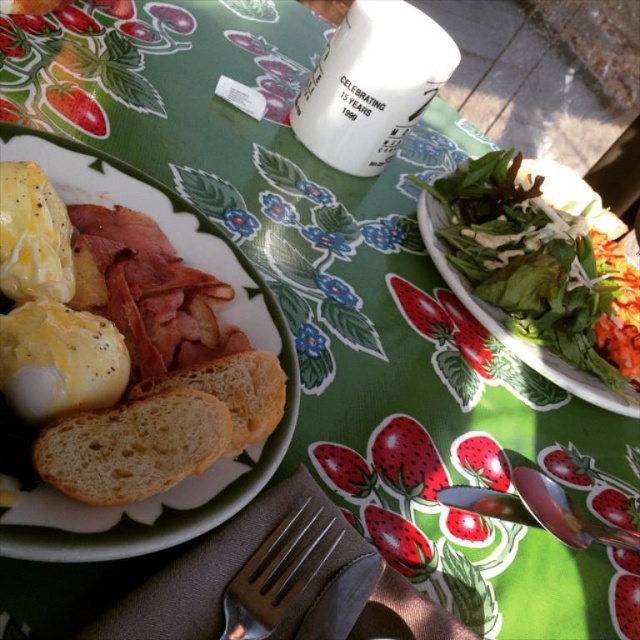
Is golden brown crusty bread at center shorter than satin silver fork at lower center?

Indeed, golden brown crusty bread at center has a lesser height compared to satin silver fork at lower center.

Is golden brown crusty bread at center thinner than satin silver fork at lower center?

Incorrect, golden brown crusty bread at center's width is not less than satin silver fork at lower center's.

Identify the location of golden brown crusty bread at center. (132, 445).

You are a GUI agent. You are given a task and a screenshot of the screen. Output one action in this format:
    pyautogui.click(x=<x>, y=<y>)
    Task: Click on the golden brown crusty bread at center
    This screenshot has width=640, height=640.
    Given the screenshot: What is the action you would take?
    pyautogui.click(x=132, y=445)

Between white matte plate at left and satin silver fork at lower center, which one is positioned higher?

white matte plate at left

Which is in front, point (269, 333) or point (237, 634)?

Point (237, 634) is in front.

Locate an element on the screen. This screenshot has height=640, width=640. white matte plate at left is located at coordinates (224, 312).

Can you confirm if white matte plate at left is positioned above golden brown crusty bread at center?

Correct, white matte plate at left is located above golden brown crusty bread at center.

You are a GUI agent. You are given a task and a screenshot of the screen. Output one action in this format:
    pyautogui.click(x=<x>, y=<y>)
    Task: Click on the white matte plate at left
    The width and height of the screenshot is (640, 640).
    Given the screenshot: What is the action you would take?
    pyautogui.click(x=224, y=312)

Identify the location of white matte plate at left. coord(224,312).